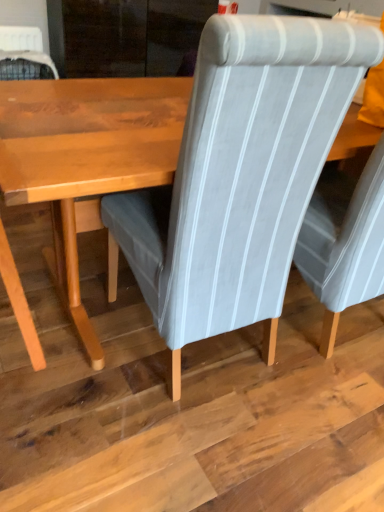
Locate an element on the screen. The image size is (384, 512). free space to the left of light gray fabric chair at center is located at coordinates (62, 345).